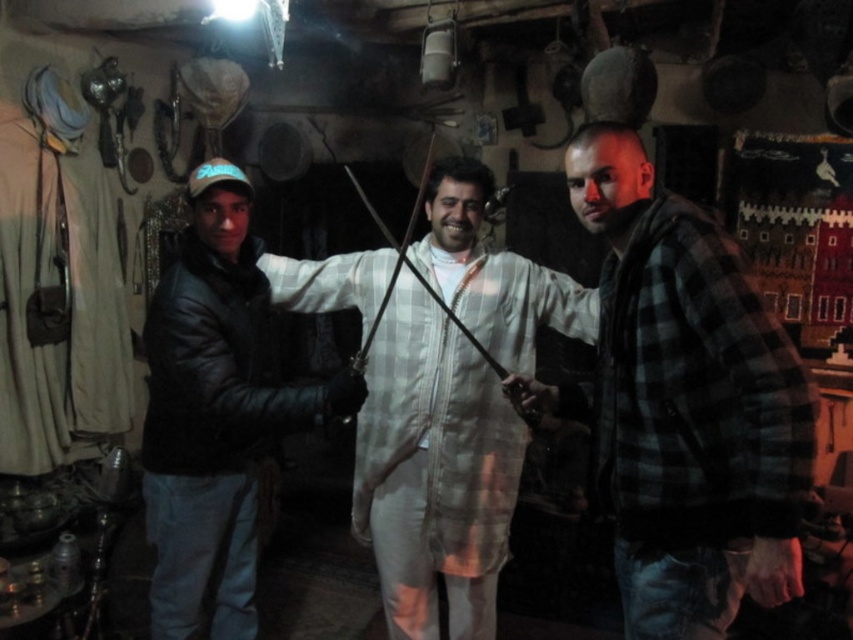
Does plaid flannel shirt at right come in front of black leather jacket at left?

Yes, it is in front of black leather jacket at left.

Is point (654, 451) positioned after point (228, 166)?

That is False.

Identify the location of plaid flannel shirt at right. (683, 404).

At what (x,y) coordinates should I click in order to perform the action: click on plaid flannel shirt at right. Please return your answer as a coordinate pair (x, y). The image size is (853, 640). Looking at the image, I should click on (683, 404).

Between white matte sword at center and black leather jacket at left, which one appears on the right side from the viewer's perspective?

From the viewer's perspective, white matte sword at center appears more on the right side.

Is point (379, 492) positioned in front of point (189, 557)?

No, (379, 492) is behind (189, 557).

Does point (492, 332) come closer to viewer compared to point (170, 547)?

No, it is not.

Find the location of a particular element. This screenshot has width=853, height=640. white matte sword at center is located at coordinates (688, 404).

Between white matte sword at center and white checkered robe at center, which one is positioned higher?

Positioned higher is white matte sword at center.

Which of these two, white matte sword at center or white checkered robe at center, stands taller?

With more height is white checkered robe at center.

Does point (724, 474) come closer to viewer compared to point (457, 342)?

Yes, it is.

This screenshot has width=853, height=640. Find the location of `white matte sword at center`. white matte sword at center is located at coordinates (688, 404).